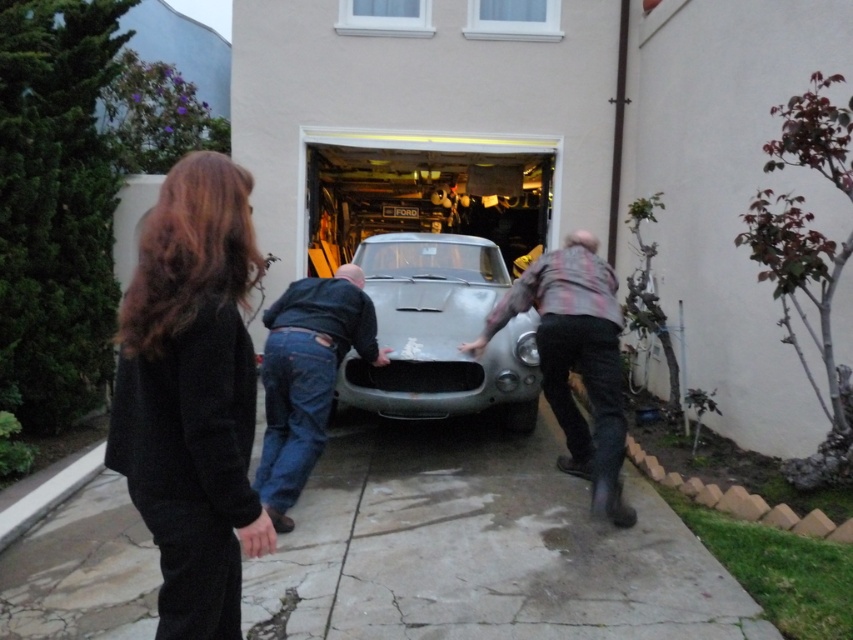
You are a delivery person trying to deliver a package to the flannel shirt at center. The package requires a clear path to the recipient. Is there enough space between the silver metallic car at center and the garage door to safely deliver the package?

The silver metallic car at center might be wider than flannel shirt at center, so there might not be enough space between the car and the garage door to safely deliver the package. The delivery person should check the width difference before proceeding.

You are standing outside the garage and see the dark brown hair at left and the flannel shirt at center. Which person is closer to you?

The dark brown hair at left is closer to you because it is in front of the flannel shirt at center.

You are standing in the driveway and see the silver metallic car at center and the flannel shirt at center. Which object is closer to the garage door?

The silver metallic car at center is closer to the garage door because it is positioned to the left of the flannel shirt at center, which would place it nearer to the garage door entrance.